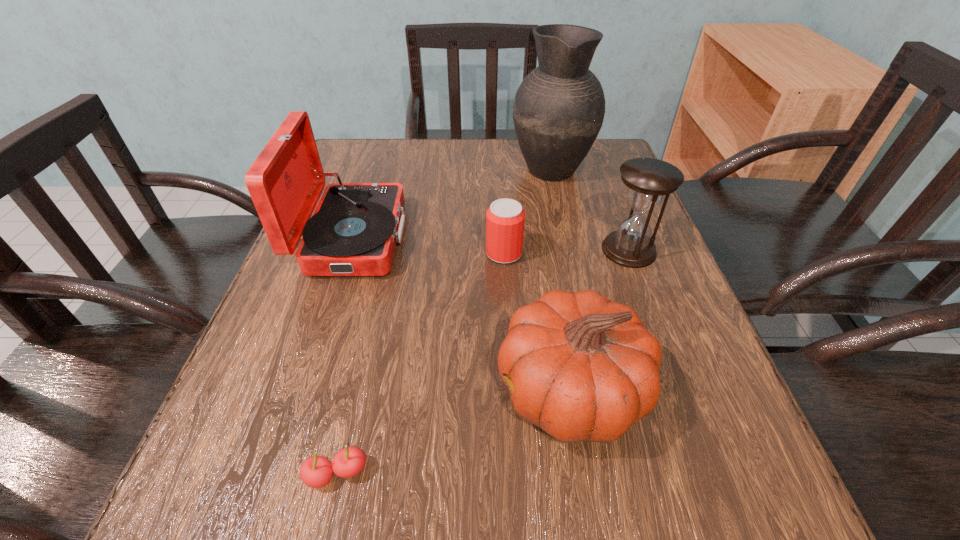
At what (x,y) coordinates should I click in order to perform the action: click on the farthest object. Please return your answer as a coordinate pair (x, y). Looking at the image, I should click on (558, 111).

Identify the location of pitcher. The height and width of the screenshot is (540, 960). (558, 111).

Find the location of `the second tallest object`. the second tallest object is located at coordinates (354, 229).

Find the location of a particular element. The image size is (960, 540). hourglass is located at coordinates (648, 180).

Where is `pumpkin`? This screenshot has width=960, height=540. pumpkin is located at coordinates (582, 368).

The width and height of the screenshot is (960, 540). I want to click on the second shortest object, so click(x=505, y=218).

You are a GUI agent. You are given a task and a screenshot of the screen. Output one action in this format:
    pyautogui.click(x=<x>, y=<y>)
    Task: Click on the cherry
    
    Given the screenshot: What is the action you would take?
    pyautogui.click(x=317, y=471)

Where is `vacant space located on the front-facing side of the second tallest object`? vacant space located on the front-facing side of the second tallest object is located at coordinates (566, 238).

Image resolution: width=960 pixels, height=540 pixels. In order to click on vacant area situated on the front of the hourglass in this screenshot , I will do `click(642, 287)`.

Find the location of `blank area located on the face of the pumpkin`. blank area located on the face of the pumpkin is located at coordinates (289, 390).